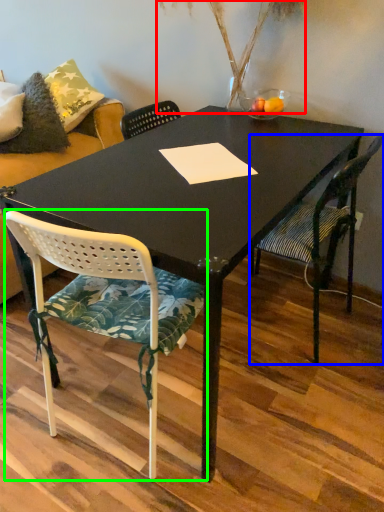
Question: Estimate the real-world distances between objects in this image. Which object is farther from plant (highlighted by a red box), chair (highlighted by a blue box) or chair (highlighted by a green box)?

Choices:
 (A) chair
 (B) chair

Answer: (B)